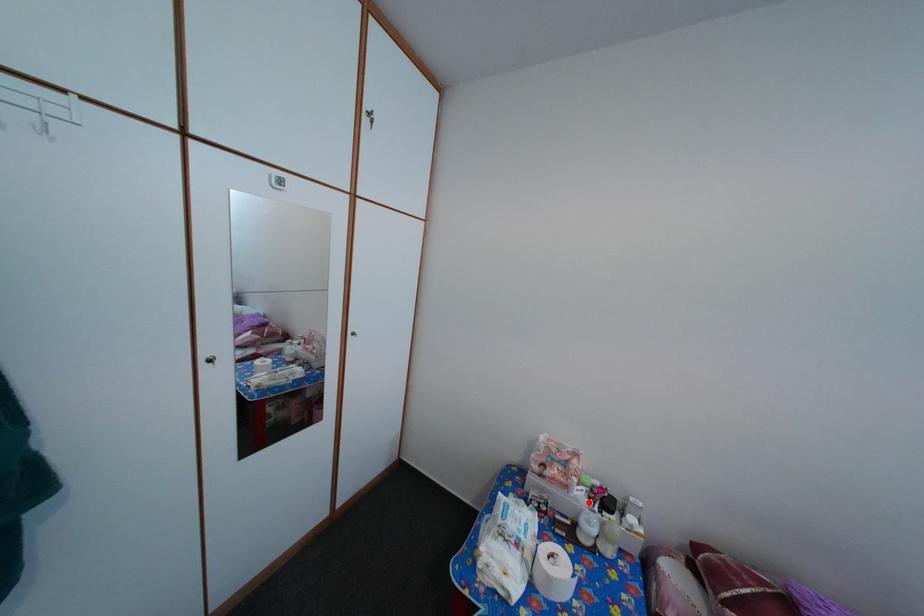
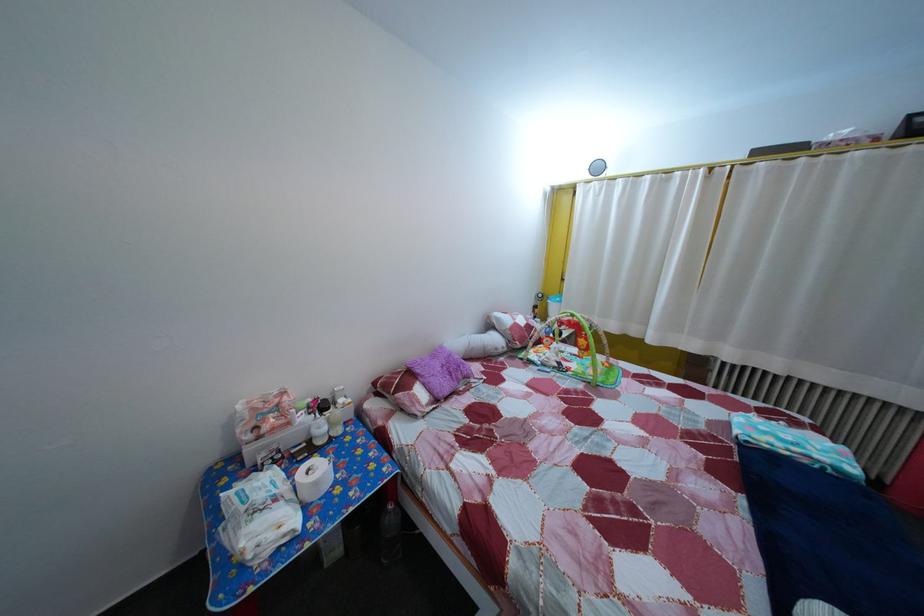
Question: I am providing you with two images of the same scene from different viewpoints. A red point is shown in image1. For the corresponding object point in image2, is it positioned nearer or farther from the camera?

Choices:
 (A) Nearer
 (B) Farther

Answer: (A)